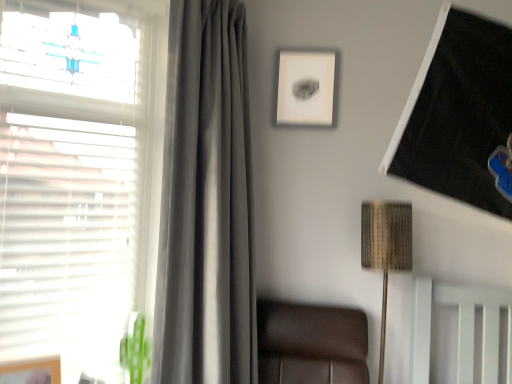
Question: In terms of height, does satin gray curtain at left look taller or shorter compared to white matte window at left?

Choices:
 (A) tall
 (B) short

Answer: (A)

Question: From a real-world perspective, is satin gray curtain at left above or below white matte window at left?

Choices:
 (A) below
 (B) above

Answer: (A)

Question: Estimate the real-world distances between objects in this image. Which object is closer to the satin gray curtain at left?

Choices:
 (A) woven fabric lampshade at upper right
 (B) wooden picture frame at lower left, the first picture frame viewed from the left
 (C) white matte window at left
 (D) matte white picture frame at upper center, positioned as the first picture frame in back-to-front order

Answer: (C)

Question: Which object is the farthest from the white matte window at left?

Choices:
 (A) matte white picture frame at upper center, which is counted as the second picture frame, starting from the bottom
 (B) satin gray curtain at left
 (C) wooden picture frame at lower left, the second picture frame positioned from the right
 (D) woven fabric lampshade at upper right

Answer: (D)